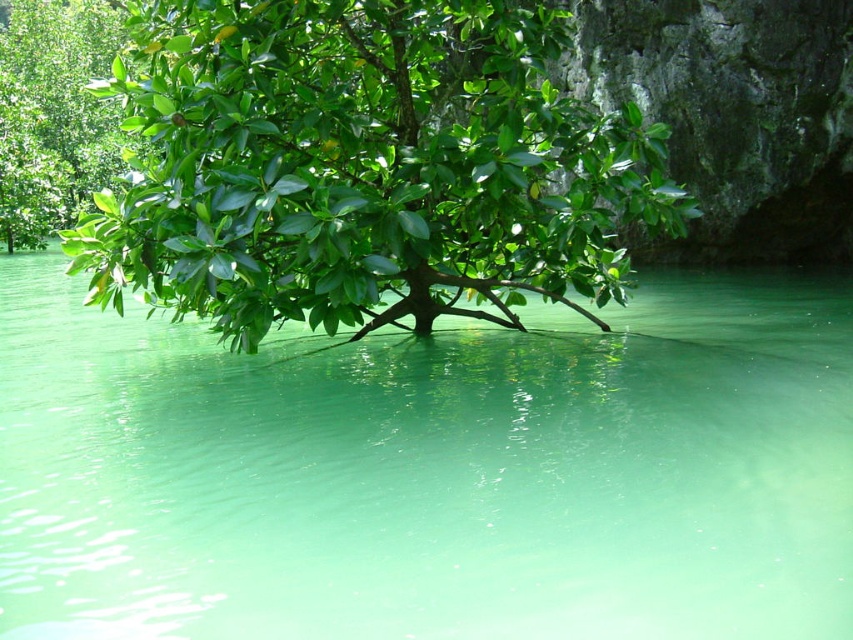
You are standing in the tranquil natural scene and want to take a photo of the tree. You notice two points marked in the image. Which point, point (38, 346) or point (71, 157), is closer to your camera lens?

Point (38, 346) is closer to the camera lens than point (71, 157).

You are a photographer planning to capture the green translucent water at center and the green glossy tree at center. Based on their spatial relationship, which object should you focus on first if you want to include both in a single frame without moving the camera?

The green glossy tree at center should be focused on first because it occupies more space than the green translucent water at center, making it the dominant subject in the frame.